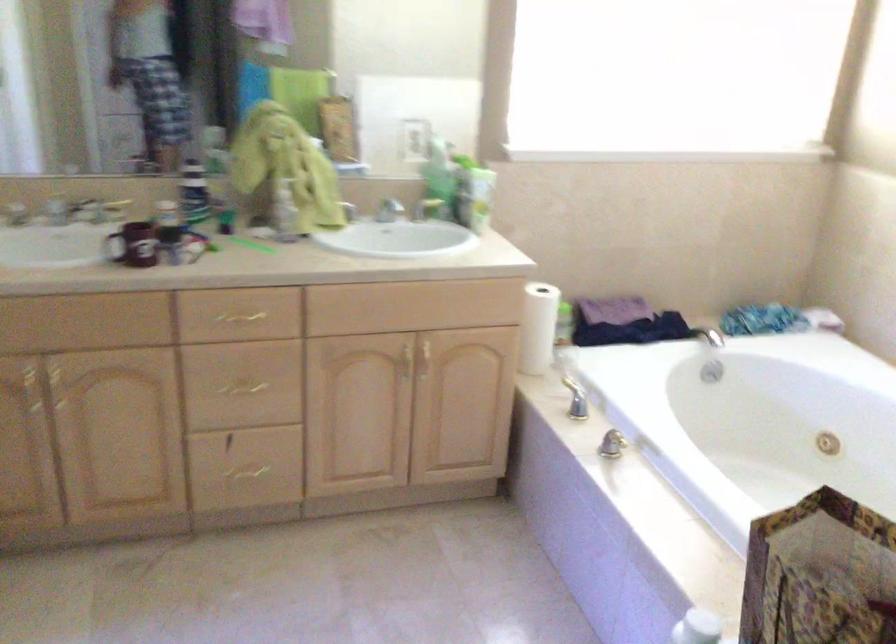
The location [538,327] corresponds to which object?

It refers to a paper towel roll.